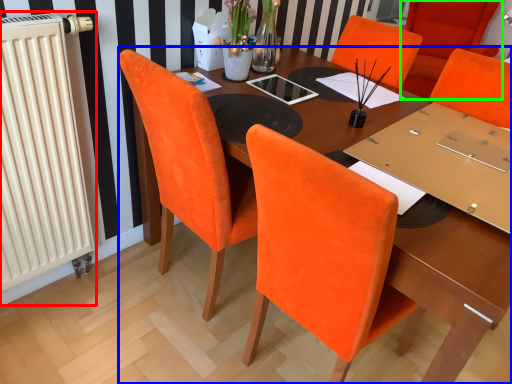
Question: Estimate the real-world distances between objects in this image. Which object is closer to radiator (highlighted by a red box), table (highlighted by a blue box) or chair (highlighted by a green box)?

Choices:
 (A) table
 (B) chair

Answer: (A)